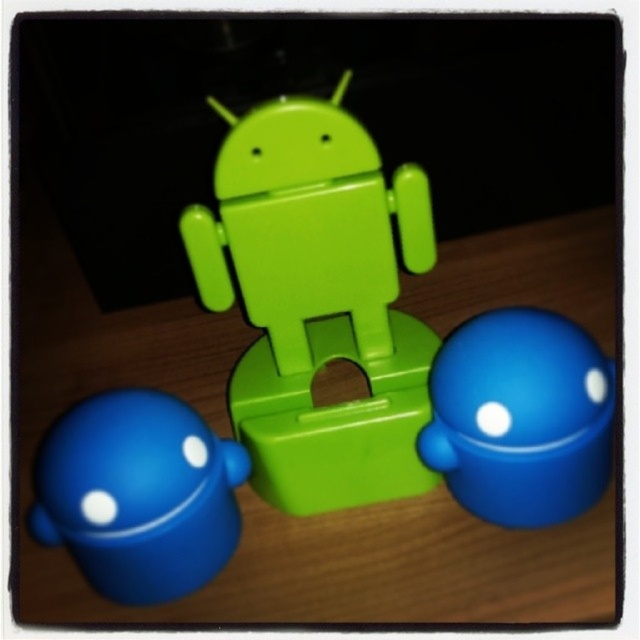
Question: Which object is the closest to the wooden table at center?

Choices:
 (A) matte blue toy at lower left
 (B) green matte android at center

Answer: (A)

Question: From the image, what is the correct spatial relationship of green matte android at center in relation to matte blue toy at lower left?

Choices:
 (A) below
 (B) above

Answer: (B)

Question: Can you confirm if matte blue toy at lower left is smaller than matte blue sphere at lower right?

Choices:
 (A) yes
 (B) no

Answer: (B)

Question: Based on their relative distances, which object is nearer to the matte blue toy at lower left?

Choices:
 (A) matte blue sphere at lower right
 (B) green matte android at center

Answer: (B)

Question: Which point appears closest to the camera in this image?

Choices:
 (A) (506, 496)
 (B) (70, 445)

Answer: (B)

Question: Can you confirm if green matte android at center is bigger than matte blue sphere at lower right?

Choices:
 (A) no
 (B) yes

Answer: (B)